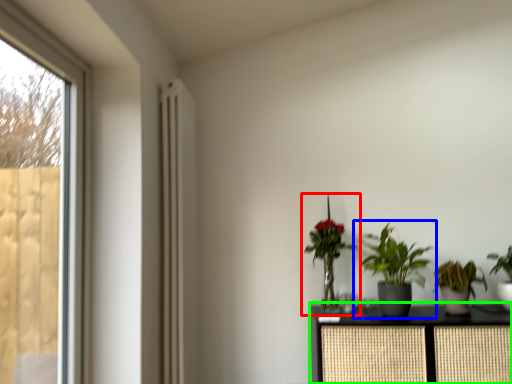
Question: Which object is the farthest from houseplant (highlighted by a red box)? Choose among these: houseplant (highlighted by a blue box) or furniture (highlighted by a green box).

Choices:
 (A) houseplant
 (B) furniture

Answer: (B)